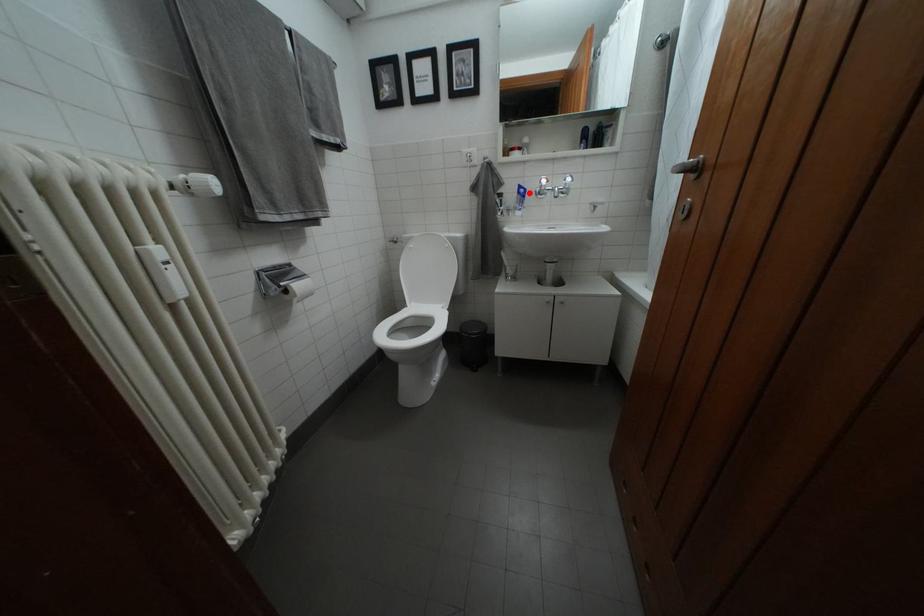
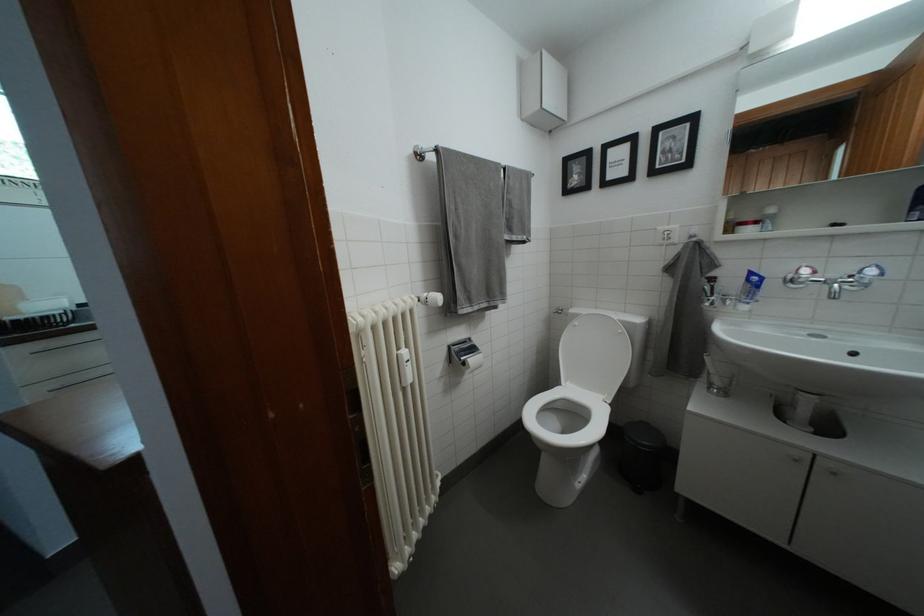
In the second image, find the point that corresponds to the highlighted location in the first image.

(760, 280)